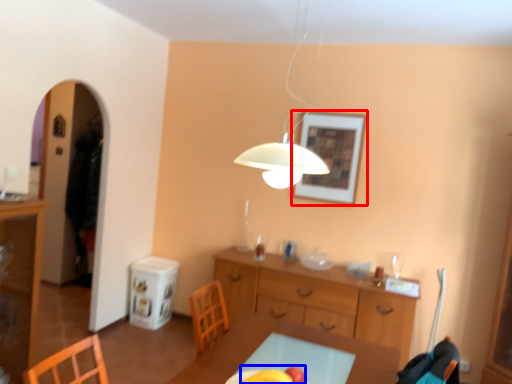
Question: Which point is further to the camera, picture frame (highlighted by a red box) or fruit (highlighted by a blue box)?

Choices:
 (A) picture frame
 (B) fruit

Answer: (A)